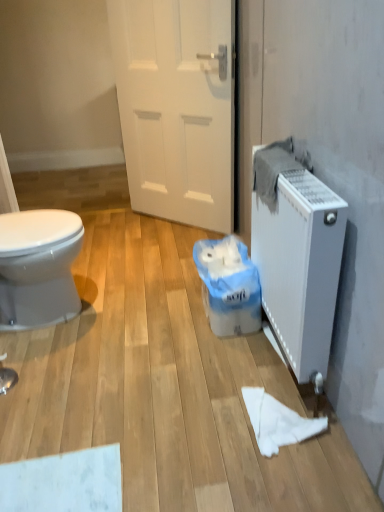
Question: Does white matte door at center have a greater width compared to white plastic bag at center?

Choices:
 (A) no
 (B) yes

Answer: (A)

Question: From a real-world perspective, does white matte door at center stand above white plastic bag at center?

Choices:
 (A) yes
 (B) no

Answer: (A)

Question: Considering the relative positions of white matte door at center and white plastic bag at center in the image provided, is white matte door at center in front of white plastic bag at center?

Choices:
 (A) no
 (B) yes

Answer: (A)

Question: Is white matte door at center beside white plastic bag at center?

Choices:
 (A) no
 (B) yes

Answer: (A)

Question: Can you confirm if white matte door at center is thinner than white plastic bag at center?

Choices:
 (A) no
 (B) yes

Answer: (B)

Question: Considering the relative sizes of white matte door at center and white plastic bag at center in the image provided, is white matte door at center smaller than white plastic bag at center?

Choices:
 (A) no
 (B) yes

Answer: (A)

Question: From a real-world perspective, is white matte door at center on top of white matte radiator at right?

Choices:
 (A) yes
 (B) no

Answer: (A)

Question: Can you confirm if white matte door at center is wider than white matte radiator at right?

Choices:
 (A) no
 (B) yes

Answer: (B)

Question: Would you say white matte door at center is outside white matte radiator at right?

Choices:
 (A) no
 (B) yes

Answer: (B)

Question: Is white matte door at center with white matte radiator at right?

Choices:
 (A) no
 (B) yes

Answer: (A)

Question: Considering the relative positions of white matte door at center and white matte radiator at right in the image provided, is white matte door at center to the right of white matte radiator at right from the viewer's perspective?

Choices:
 (A) yes
 (B) no

Answer: (B)

Question: Does white matte door at center have a greater height compared to white matte radiator at right?

Choices:
 (A) yes
 (B) no

Answer: (A)

Question: Is white paper towel at lower center not inside white matte radiator at right?

Choices:
 (A) yes
 (B) no

Answer: (A)